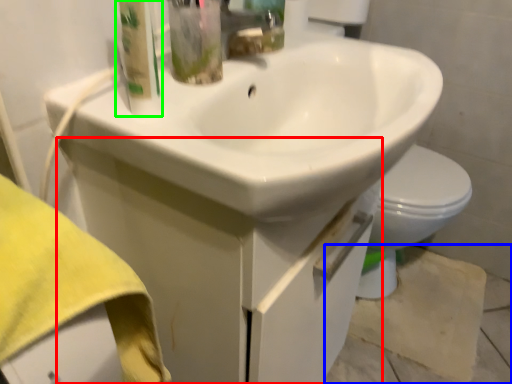
Question: Which object is positioned closest to drawer (highlighted by a red box)? Select from concrete (highlighted by a blue box) and cleaning product (highlighted by a green box).

Choices:
 (A) concrete
 (B) cleaning product

Answer: (B)